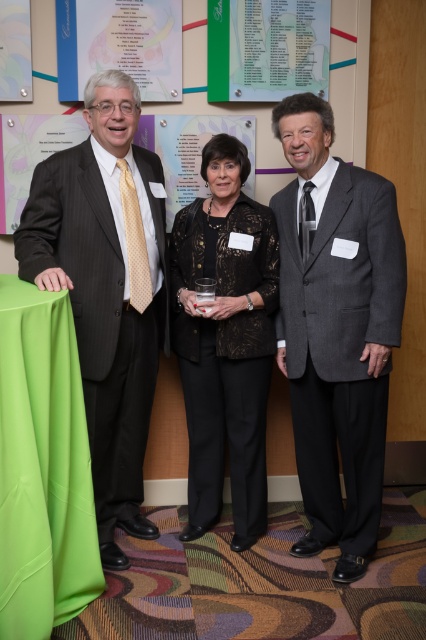
You are organizing a small event and need to determine which green item can cover a larger area for a display. Which one is bigger between the green satin tablecloth at lower left and the green paperboard poster at upper center?

The green satin tablecloth at lower left is bigger than the green paperboard poster at upper center, so it can cover a larger area for the display.

You are organizing a photoshoot and need to ensure that the matte black suit at left and the green satin tablecloth at lower left fit within a frame that can only accommodate objects up to the size of the larger object. Which object determines the maximum frame size needed?

The matte black suit at left determines the maximum frame size needed because its width is larger than the green satin tablecloth at lower left.